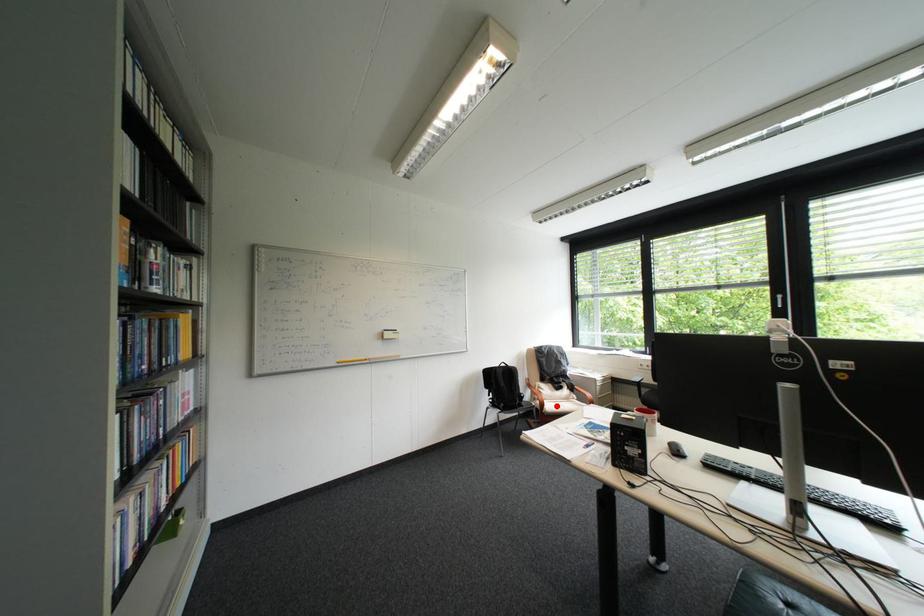
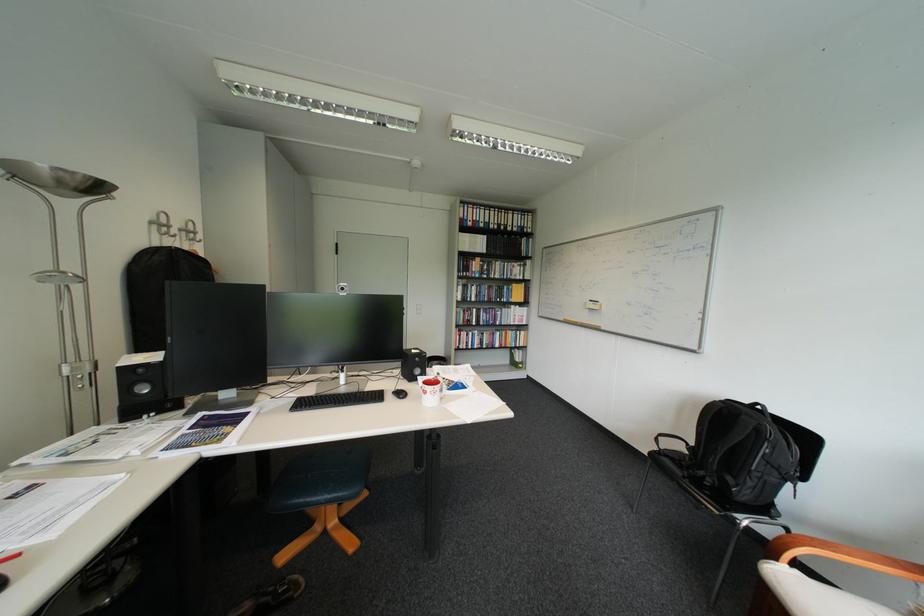
Locate, in the second image, the point that corresponds to the highlighted location in the first image.

(788, 560)